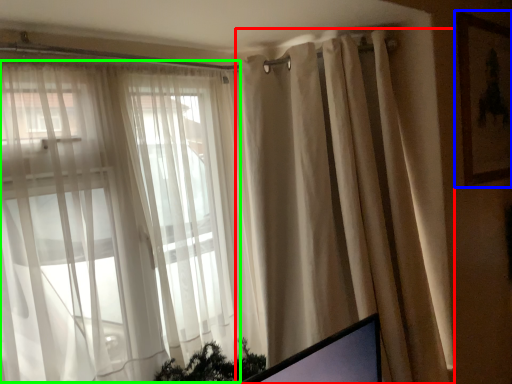
Question: Considering the real-world distances, which object is closest to curtain (highlighted by a red box)? picture frame (highlighted by a blue box) or bay window (highlighted by a green box).

Choices:
 (A) picture frame
 (B) bay window

Answer: (B)